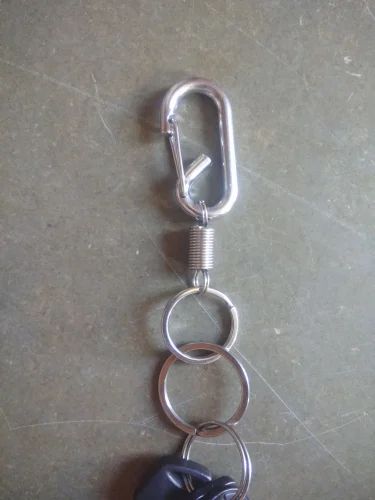
Image resolution: width=375 pixels, height=500 pixels. What are the coordinates of `table top` in the screenshot? It's located at (263, 106).